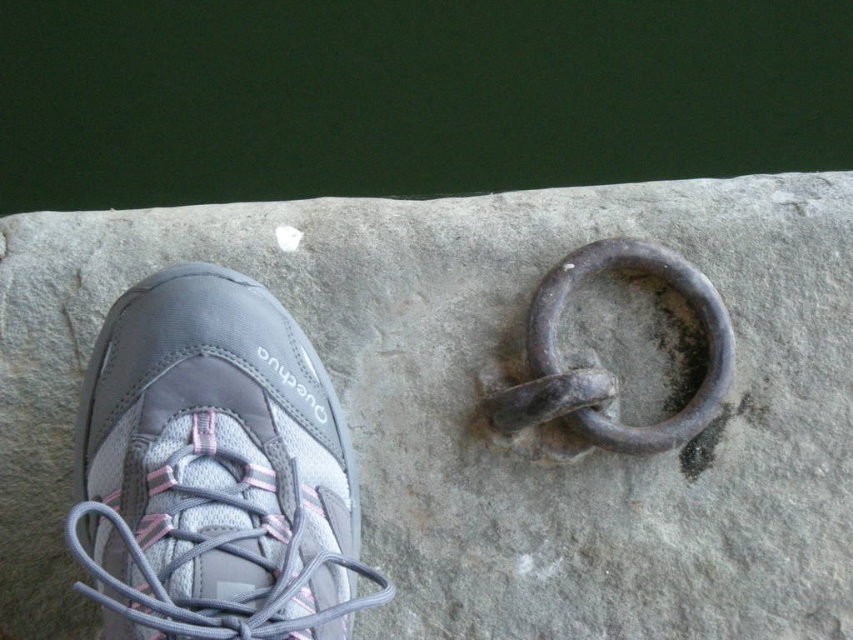
Consider the image. Does gray fabric shoe at left appear on the left side of rusty metal ring at center?

Indeed, gray fabric shoe at left is positioned on the left side of rusty metal ring at center.

Does gray fabric shoe at left have a lesser width compared to rusty metal ring at center?

Incorrect, gray fabric shoe at left's width is not less than rusty metal ring at center's.

Measure the distance between gray fabric shoe at left and camera.

gray fabric shoe at left is 3.48 feet away from camera.

Find the location of `gray fabric shoe at left`. gray fabric shoe at left is located at coordinates (213, 470).

Which is above, gray stone ring at center or gray fabric shoe at left?

gray stone ring at center

Does point (171, 252) come farther from viewer compared to point (187, 499)?

That is True.

Does point (177, 216) come closer to viewer compared to point (84, 429)?

That is False.

Locate an element on the screen. The height and width of the screenshot is (640, 853). gray stone ring at center is located at coordinates (474, 401).

Is point (784, 296) positioned before point (625, 440)?

That is False.

Is gray stone ring at center positioned behind rusty metal ring at center?

Yes, it is behind rusty metal ring at center.

Where is `gray stone ring at center`? The height and width of the screenshot is (640, 853). gray stone ring at center is located at coordinates (474, 401).